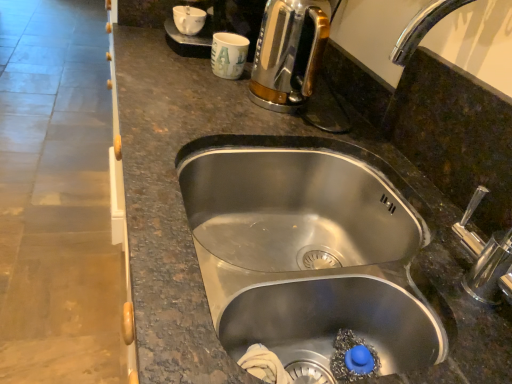
Question: Should I look upward or downward to see white glossy coffee cup at upper center, which is the 1th coffee cup in left-to-right order?

Choices:
 (A) down
 (B) up

Answer: (B)

Question: Does white glossy coffee cup at upper center, marked as the 2th coffee cup in a right-to-left arrangement, have a smaller size compared to white paper cup at upper center, the second coffee cup positioned from the top?

Choices:
 (A) no
 (B) yes

Answer: (B)

Question: Considering the relative sizes of white glossy coffee cup at upper center, which is the 1th coffee cup in top-to-bottom order, and white paper cup at upper center, acting as the 1th coffee cup starting from the right, in the image provided, is white glossy coffee cup at upper center, which is the 1th coffee cup in top-to-bottom order, wider than white paper cup at upper center, acting as the 1th coffee cup starting from the right,?

Choices:
 (A) no
 (B) yes

Answer: (A)

Question: Is white paper cup at upper center, acting as the 1th coffee cup starting from the right, inside white glossy coffee cup at upper center, which is the 1th coffee cup in top-to-bottom order?

Choices:
 (A) no
 (B) yes

Answer: (A)

Question: Is white glossy coffee cup at upper center, marked as the 2th coffee cup in a right-to-left arrangement, positioned far away from white paper cup at upper center, which ranks as the 2th coffee cup in left-to-right order?

Choices:
 (A) no
 (B) yes

Answer: (A)

Question: Is white glossy coffee cup at upper center, which is the 1th coffee cup in left-to-right order, at the left side of white paper cup at upper center, acting as the 1th coffee cup starting from the right?

Choices:
 (A) yes
 (B) no

Answer: (A)

Question: Is white glossy coffee cup at upper center, which appears as the second coffee cup when ordered from the bottom, directly adjacent to white paper cup at upper center, which ranks as the 2th coffee cup in left-to-right order?

Choices:
 (A) yes
 (B) no

Answer: (B)

Question: From a real-world perspective, is shiny metallic kettle at upper right on white glossy coffee cup at upper center, which appears as the second coffee cup when ordered from the bottom?

Choices:
 (A) no
 (B) yes

Answer: (B)

Question: From a real-world perspective, does shiny metallic kettle at upper right sit lower than white glossy coffee cup at upper center, marked as the 2th coffee cup in a right-to-left arrangement?

Choices:
 (A) yes
 (B) no

Answer: (B)

Question: Is shiny metallic kettle at upper right wider than white glossy coffee cup at upper center, marked as the 2th coffee cup in a right-to-left arrangement?

Choices:
 (A) no
 (B) yes

Answer: (B)

Question: From the image's perspective, would you say shiny metallic kettle at upper right is shown under white glossy coffee cup at upper center, marked as the 2th coffee cup in a right-to-left arrangement?

Choices:
 (A) no
 (B) yes

Answer: (B)

Question: Considering the relative sizes of shiny metallic kettle at upper right and white glossy coffee cup at upper center, which appears as the second coffee cup when ordered from the bottom, in the image provided, is shiny metallic kettle at upper right bigger than white glossy coffee cup at upper center, which appears as the second coffee cup when ordered from the bottom,?

Choices:
 (A) no
 (B) yes

Answer: (B)

Question: Could you tell me if shiny metallic kettle at upper right is turned towards white glossy coffee cup at upper center, marked as the 2th coffee cup in a right-to-left arrangement?

Choices:
 (A) no
 (B) yes

Answer: (A)

Question: Is shiny metallic kettle at upper right facing towards stainless steel sink at center?

Choices:
 (A) no
 (B) yes

Answer: (A)